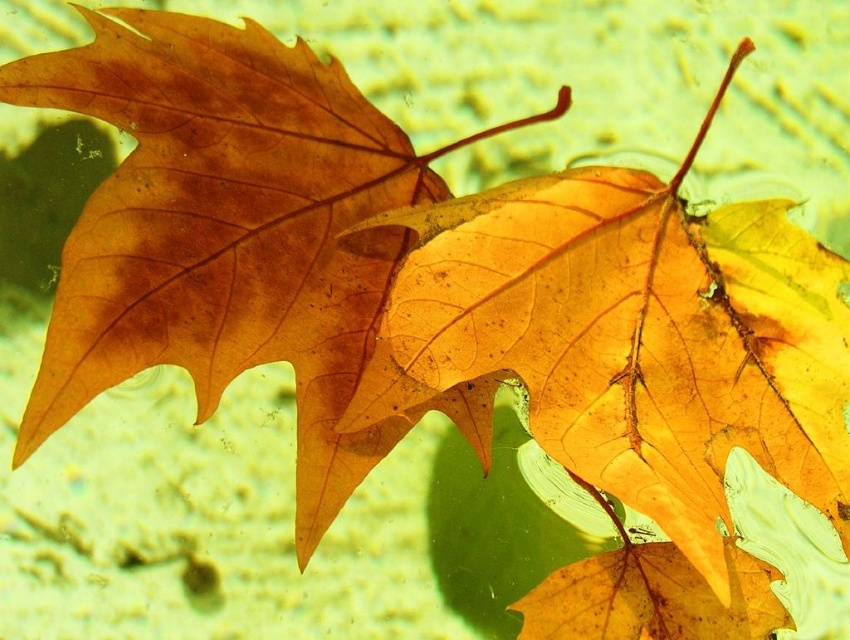
You are an artist trying to paint a leaf arrangement. You have two leaves in front of you, the shiny orange leaf at center and the matte orange leaf at center. Which leaf should you choose if you want to use the smaller one for your painting?

The shiny orange leaf at center has a smaller width than the matte orange leaf at center, so you should choose the shiny orange leaf at center for your painting.